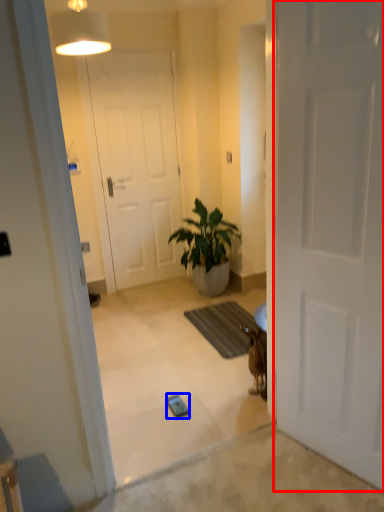
Question: Which object is closer to the camera taking this photo, door (highlighted by a red box) or mobile phone (highlighted by a blue box)?

Choices:
 (A) door
 (B) mobile phone

Answer: (A)